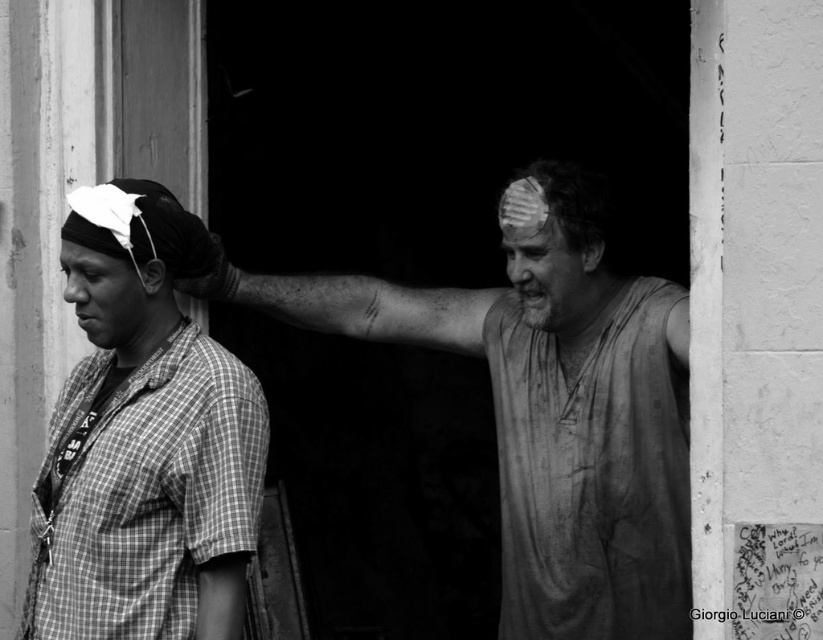
Which is more to the left, dirty white tank top at center or checkered fabric shirt at left?

checkered fabric shirt at left

Is dirty white tank top at center smaller than checkered fabric shirt at left?

Actually, dirty white tank top at center might be larger than checkered fabric shirt at left.

Where is `dirty white tank top at center`? dirty white tank top at center is located at coordinates (551, 410).

Who is shorter, white fabric headband at left or dirty white head at right?

With less height is dirty white head at right.

Is white fabric headband at left above dirty white head at right?

No.

Find the location of a particular element. The image size is (823, 640). white fabric headband at left is located at coordinates (129, 266).

Does white fabric headband at left have a greater height compared to matte white bandage at upper center?

Yes, white fabric headband at left is taller than matte white bandage at upper center.

Between white fabric headband at left and matte white bandage at upper center, which one has more height?

white fabric headband at left is taller.

Is point (145, 180) positioned in front of point (523, 232)?

Yes.

Where is `white fabric headband at left`? The image size is (823, 640). white fabric headband at left is located at coordinates (129, 266).